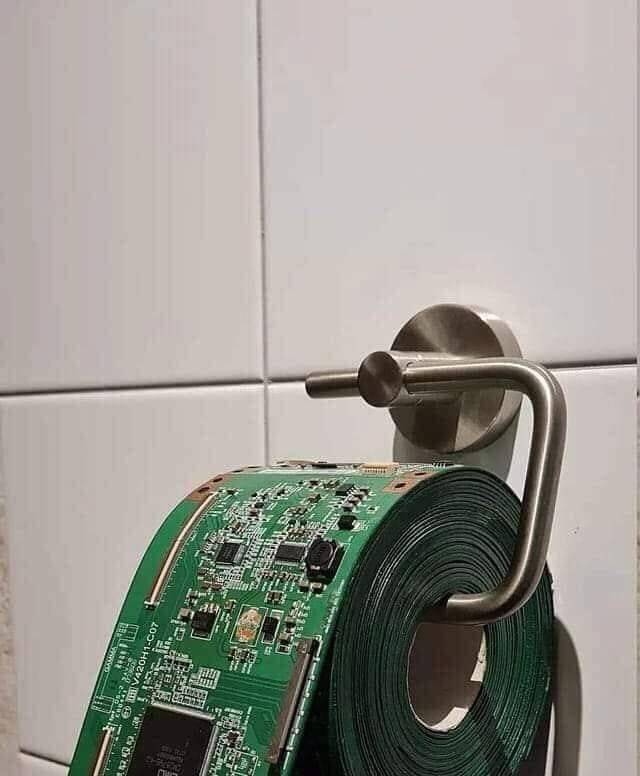
Where is `glare on top right edge of the round silver hardware attached to tiles`? glare on top right edge of the round silver hardware attached to tiles is located at coordinates (488, 317).